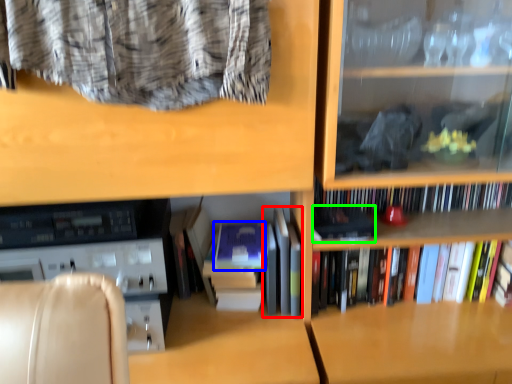
Question: Which object is the farthest from book (highlighted by a red box)? Choose among these: paperback book (highlighted by a blue box) or paperback book (highlighted by a green box).

Choices:
 (A) paperback book
 (B) paperback book

Answer: (B)